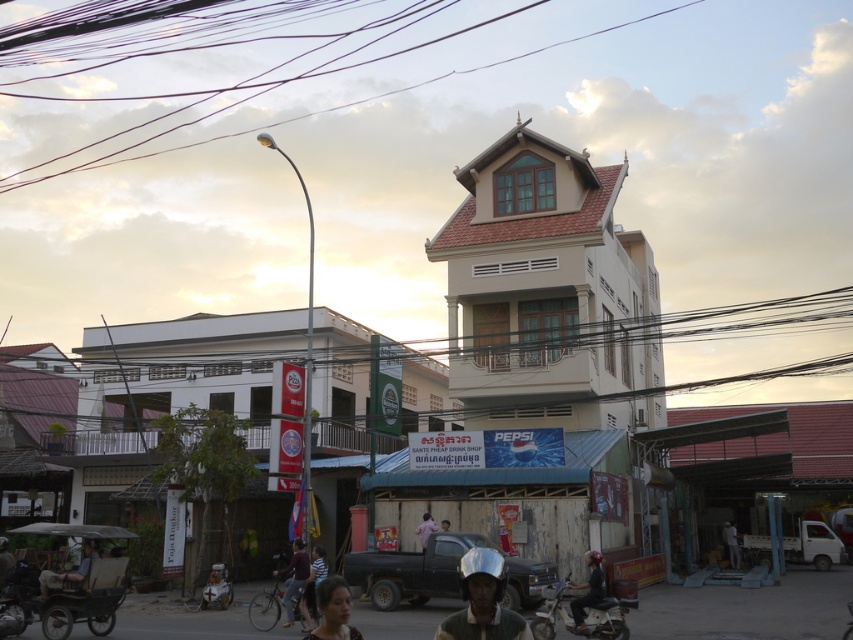
Question: Which object is farther from the camera taking this photo?

Choices:
 (A) pink fabric shirt at center
 (B) purple wire at upper center
 (C) silver metallic helmet at center
 (D) black matte truck at center

Answer: (B)

Question: Which object appears farthest from the camera in this image?

Choices:
 (A) dark blue helmet at lower center
 (B) striped shirt at lower center

Answer: (A)

Question: Based on their relative distances, which object is nearer to the brown wooden power line at upper center?

Choices:
 (A) jeans at center
 (B) black matte truck at center
 (C) khaki fabric pants at lower left
 (D) matte black helmet at lower center

Answer: (C)

Question: Can you confirm if metallic silver motorcycle at lower center is thinner than light brown leather jacket at center?

Choices:
 (A) yes
 (B) no

Answer: (B)

Question: Is dark blue helmet at lower center to the left of pink fabric shirt at center from the viewer's perspective?

Choices:
 (A) yes
 (B) no

Answer: (B)

Question: Is purple wire at upper center above dark blue helmet at lower center?

Choices:
 (A) yes
 (B) no

Answer: (A)